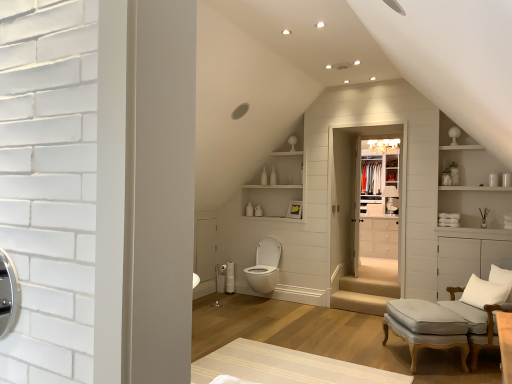
Looking at this image, what is the approximate width of matte white lampshade at center?

11.16 inches.

The height and width of the screenshot is (384, 512). What do you see at coordinates (482, 308) in the screenshot?
I see `light gray fabric chair at lower right` at bounding box center [482, 308].

Image resolution: width=512 pixels, height=384 pixels. What do you see at coordinates (278, 180) in the screenshot?
I see `white matte shelves at upper center` at bounding box center [278, 180].

Describe the element at coordinates (383, 201) in the screenshot. Image resolution: width=512 pixels, height=384 pixels. I see `white glossy medicine cabinet at center` at that location.

What do you see at coordinates (364, 295) in the screenshot? The height and width of the screenshot is (384, 512). I see `beige carpeted stairs at lower center` at bounding box center [364, 295].

What do you see at coordinates (484, 292) in the screenshot? The width and height of the screenshot is (512, 384). I see `white soft cushion at lower right` at bounding box center [484, 292].

What are the coordinates of `matte white lampshade at center` in the screenshot? It's located at (390, 199).

Looking at this image, considering the sizes of objects white glossy medicine cabinet at center and matte white lampshade at center in the image provided, who is shorter, white glossy medicine cabinet at center or matte white lampshade at center?

Standing shorter between the two is matte white lampshade at center.

Based on the photo, could you tell me if white glossy medicine cabinet at center is facing matte white lampshade at center?

Yes, white glossy medicine cabinet at center faces towards matte white lampshade at center.

Between white glossy medicine cabinet at center and matte white lampshade at center, which one is positioned in front?

white glossy medicine cabinet at center is closer to the camera.

Image resolution: width=512 pixels, height=384 pixels. What are the coordinates of `medicine cabinet located underneath the matte white lampshade at center (from a real-world perspective)` in the screenshot? It's located at (383, 201).

Between white soft cushion at lower right and matte white lampshade at center, which one has larger size?

matte white lampshade at center.

Considering the sizes of objects white soft cushion at lower right and matte white lampshade at center in the image provided, who is shorter, white soft cushion at lower right or matte white lampshade at center?

Standing shorter between the two is white soft cushion at lower right.

What are the coordinates of `pillow on the left of matte white lampshade at center` in the screenshot? It's located at (484, 292).

Which point is more forward, (x=507, y=290) or (x=385, y=188)?

The point (x=507, y=290) is more forward.

Is clear glass closet door at center not near light gray fabric chair at lower right?

Yes, clear glass closet door at center and light gray fabric chair at lower right are located far from each other.

In the scene shown: Between clear glass closet door at center and light gray fabric chair at lower right, which one appears on the left side from the viewer's perspective?

From the viewer's perspective, clear glass closet door at center appears more on the left side.

Where is `glass door on the left side of light gray fabric chair at lower right`? glass door on the left side of light gray fabric chair at lower right is located at coordinates (364, 223).

Considering the sizes of objects clear glass closet door at center and light gray fabric chair at lower right in the image provided, who is bigger, clear glass closet door at center or light gray fabric chair at lower right?

With larger size is light gray fabric chair at lower right.

Considering the sizes of white glossy medicine cabinet at center and beige carpeted stairs at lower center in the image, is white glossy medicine cabinet at center wider or thinner than beige carpeted stairs at lower center?

white glossy medicine cabinet at center is thinner than beige carpeted stairs at lower center.

Can we say white glossy medicine cabinet at center lies outside beige carpeted stairs at lower center?

Indeed, white glossy medicine cabinet at center is completely outside beige carpeted stairs at lower center.

Could you measure the distance between white glossy medicine cabinet at center and beige carpeted stairs at lower center?

white glossy medicine cabinet at center and beige carpeted stairs at lower center are 27.51 inches apart from each other.

Is the position of white glossy medicine cabinet at center more distant than that of beige carpeted stairs at lower center?

Yes.

From the image's perspective, which is below, white glossy toilet at center or light gray fabric stool at lower right?

light gray fabric stool at lower right.

The image size is (512, 384). What are the coordinates of `toilet above the light gray fabric stool at lower right (from a real-world perspective)` in the screenshot? It's located at (265, 266).

Is white glossy toilet at center facing towards light gray fabric stool at lower right?

No, white glossy toilet at center is not oriented towards light gray fabric stool at lower right.

Which of these two, white glossy toilet at center or light gray fabric stool at lower right, is wider?

white glossy toilet at center.

Image resolution: width=512 pixels, height=384 pixels. I want to click on chair located on the left of white glossy cabinet at center, so click(482, 308).

Is light gray fabric chair at lower right directly adjacent to white glossy cabinet at center?

light gray fabric chair at lower right and white glossy cabinet at center are clearly separated.

How distant is light gray fabric chair at lower right from white glossy cabinet at center?

A distance of 5.61 feet exists between light gray fabric chair at lower right and white glossy cabinet at center.

Is light gray fabric chair at lower right taller or shorter than white glossy cabinet at center?

light gray fabric chair at lower right is taller than white glossy cabinet at center.

Considering the positions of points (481, 284) and (477, 285), is point (481, 284) farther from camera compared to point (477, 285)?

No, (481, 284) is in front of (477, 285).

Considering the positions of objects light gray fabric chair at lower right and white soft cushion at lower right in the image provided, who is in front, light gray fabric chair at lower right or white soft cushion at lower right?

light gray fabric chair at lower right is more forward.

Consider the image. Between light gray fabric chair at lower right and white soft cushion at lower right, which one has larger width?

With larger width is light gray fabric chair at lower right.

Based on the photo, can you confirm if light gray fabric chair at lower right is positioned to the left of white soft cushion at lower right?

No.

Identify the location of lamp on the right of white glossy medicine cabinet at center. The height and width of the screenshot is (384, 512). (390, 199).

I want to click on lamp behind the white soft cushion at lower right, so click(390, 199).

From the image, which object appears to be farther from beige carpeted stairs at lower center, white glossy cabinet at center or beige striped rug at center?

beige striped rug at center lies further to beige carpeted stairs at lower center than the other object.

Estimate the real-world distances between objects in this image. Which object is further from clear glass closet door at center, beige carpeted stairs at lower center or white glossy cabinet at center?

Among the two, beige carpeted stairs at lower center is located further to clear glass closet door at center.

When comparing their distances from white soft cushion at lower right, does beige carpeted stairs at lower center or white glossy medicine cabinet at center seem closer?

beige carpeted stairs at lower center is positioned closer to the anchor white soft cushion at lower right.

From the image, which object appears to be farther from white glossy toilet at center, white soft cushion at lower right or white glossy cabinet at center?

white soft cushion at lower right.

Estimate the real-world distances between objects in this image. Which object is closer to light gray fabric chair at lower right, clear glass closet door at center or white glossy cabinet at upper right?

Based on the image, white glossy cabinet at upper right appears to be nearer to light gray fabric chair at lower right.

Looking at the image, which one is located further to matte white lampshade at center, white glossy medicine cabinet at center or white glossy cabinet at upper right?

Based on the image, white glossy cabinet at upper right appears to be further to matte white lampshade at center.

Estimate the real-world distances between objects in this image. Which object is closer to white glossy cabinet at upper right, clear glass closet door at center or white matte shelves at upper center?

clear glass closet door at center is positioned closer to the anchor white glossy cabinet at upper right.

Estimate the real-world distances between objects in this image. Which object is further from beige carpeted stairs at lower center, white matte shelves at upper center or white soft cushion at lower right?

white matte shelves at upper center is further to beige carpeted stairs at lower center.

Locate an element on the screen. glass door between beige striped rug at center and white matte shelves at upper center in the front-back direction is located at coordinates (364, 223).

I want to click on stool between beige striped rug at center and white glossy cabinet at upper right in the horizontal direction, so click(423, 323).

At what (x,y) coordinates should I click in order to perform the action: click on stairwell between light gray fabric chair at lower right and matte white lampshade at center in the front-back direction. Please return your answer as a coordinate pair (x, y). Image resolution: width=512 pixels, height=384 pixels. Looking at the image, I should click on (364, 295).

Where is `stairwell located between light gray fabric chair at lower right and white glossy cabinet at center in the depth direction`? The image size is (512, 384). stairwell located between light gray fabric chair at lower right and white glossy cabinet at center in the depth direction is located at coordinates click(x=364, y=295).